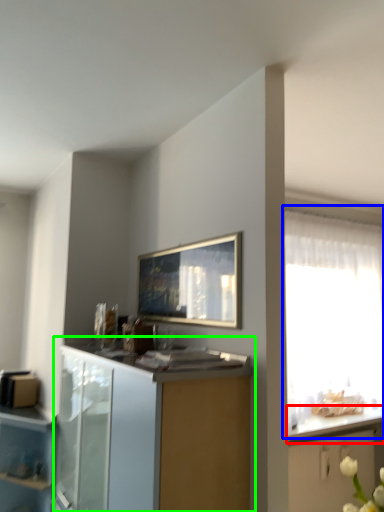
Question: Estimate the real-world distances between objects in this image. Which object is farther from countertop (highlighted by a red box), window (highlighted by a blue box) or cabinetry (highlighted by a green box)?

Choices:
 (A) window
 (B) cabinetry

Answer: (B)